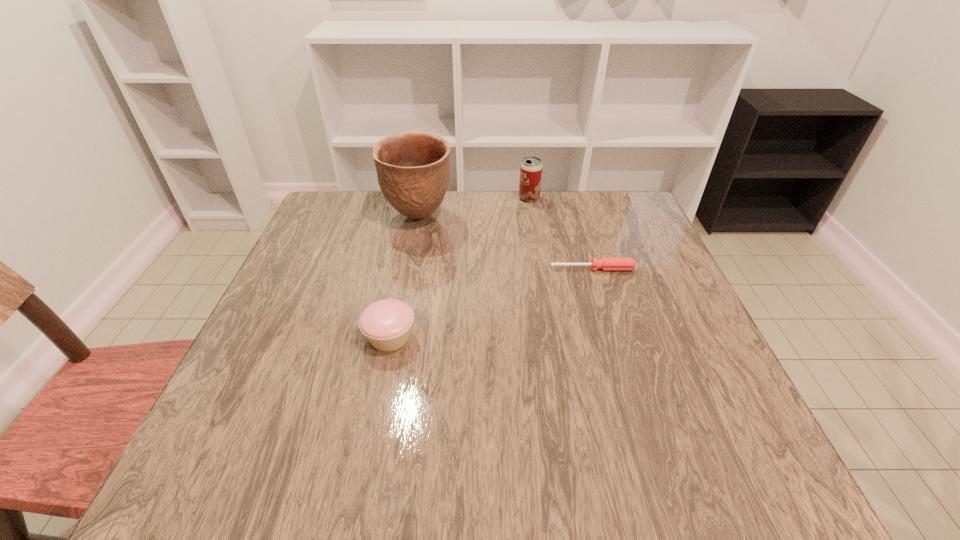
Locate which object is the third closest to the beer can. Please provide its 2D coordinates. Your answer should be formatted as a tuple, i.e. [(x, y)], where the tuple contains the x and y coordinates of a point satisfying the conditions above.

[(387, 323)]

At what (x,y) coordinates should I click in order to perform the action: click on free space that satisfies the following two spatial constraints: 1. on the back side of the pottery; 2. on the right side of the beer can. Please return your answer as a coordinate pair (x, y). Looking at the image, I should click on (422, 198).